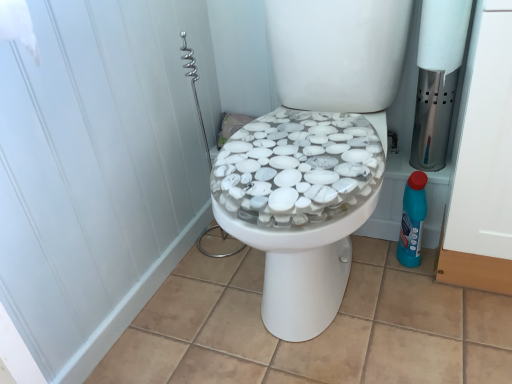
Where is `free space to the left of blue plastic bottle at right`? free space to the left of blue plastic bottle at right is located at coordinates (368, 263).